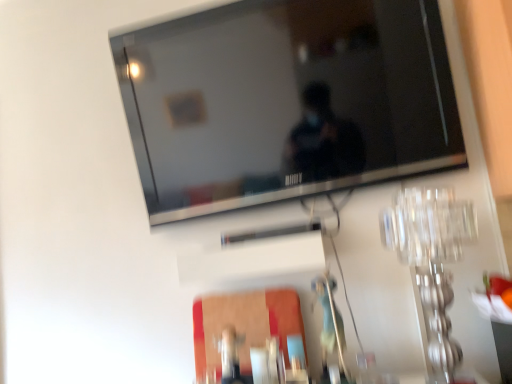
I want to click on matte black tv at upper center, so click(x=286, y=101).

This screenshot has height=384, width=512. What do you see at coordinates (286, 101) in the screenshot?
I see `matte black tv at upper center` at bounding box center [286, 101].

Locate an element on the screen. This screenshot has height=384, width=512. matte black tv at upper center is located at coordinates (286, 101).